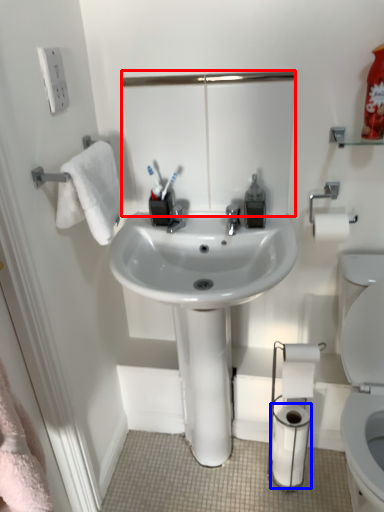
Question: Which object is closer to the camera taking this photo, mirror (highlighted by a red box) or toilet paper (highlighted by a blue box)?

Choices:
 (A) mirror
 (B) toilet paper

Answer: (A)